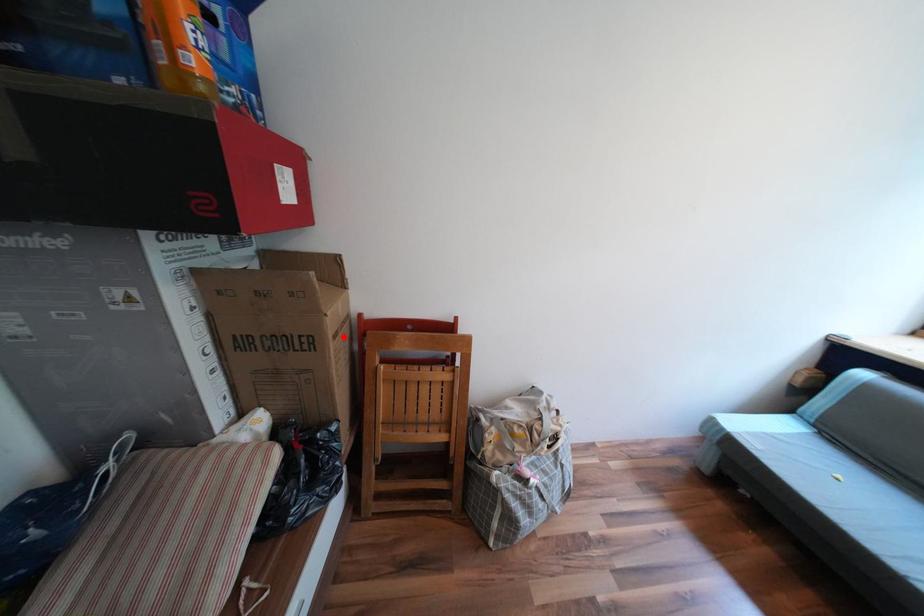
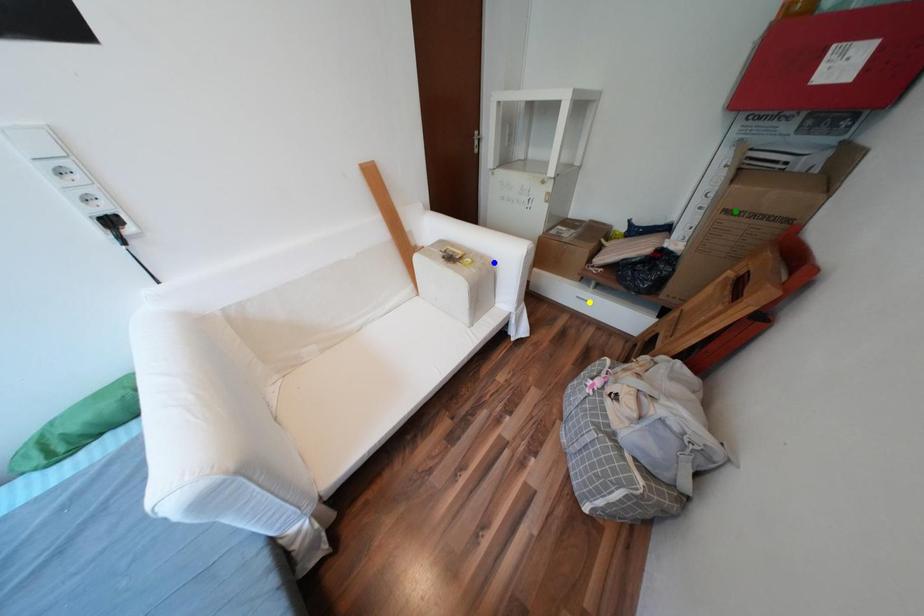
Question: I am providing you with two images of the same scene from different viewpoints. A red point is marked on the first image. You are given multiple points on the second image. In image 2, which mark is for the same physical point as the one in image 1?

Choices:
 (A) blue point
 (B) green point
 (C) yellow point

Answer: (B)